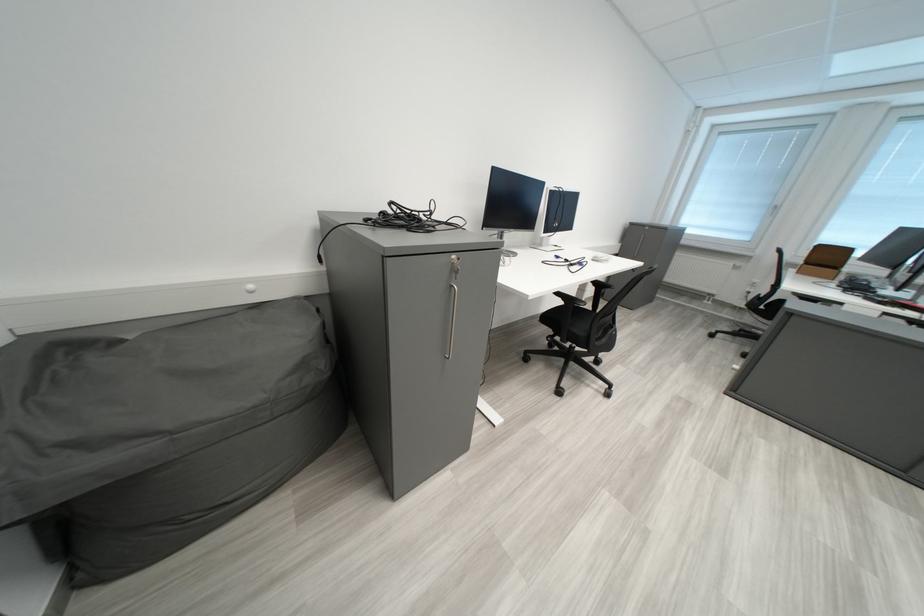
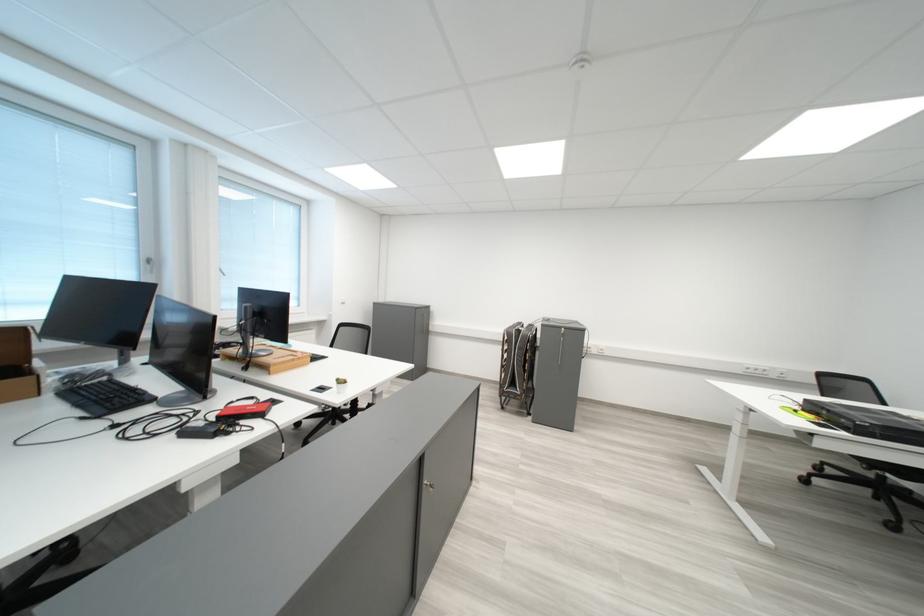
Locate, in the second image, the point that corresponds to (x=881, y=301) in the first image.

(200, 436)